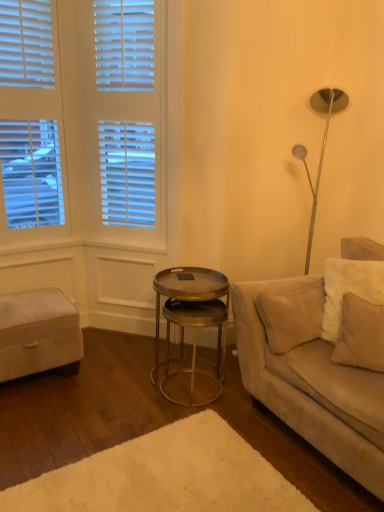
Question: From a real-world perspective, relative to beige fabric pillow at right, is suede beige couch at right vertically above or below?

Choices:
 (A) above
 (B) below

Answer: (B)

Question: Do you think suede beige couch at right is within beige fabric pillow at right, or outside of it?

Choices:
 (A) inside
 (B) outside

Answer: (B)

Question: Which of these objects is positioned closest to the beige fabric pillow at right?

Choices:
 (A) metallic gold side table at center
 (B) suede beige couch at right
 (C) white fabric ottoman at lower left
 (D) white plush rug at lower center

Answer: (B)

Question: Estimate the real-world distances between objects in this image. Which object is closer to the suede beige couch at right?

Choices:
 (A) metallic gold side table at center
 (B) white plush rug at lower center
 (C) beige fabric pillow at right
 (D) white fabric ottoman at lower left

Answer: (C)